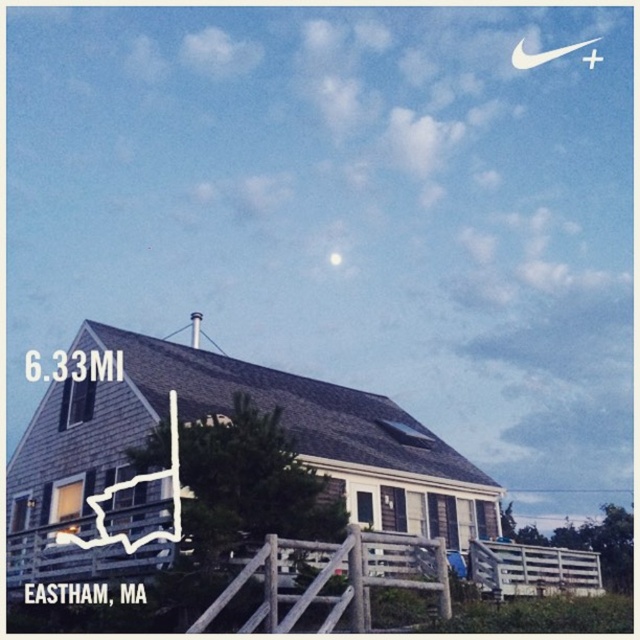
Question: Which of the following is the closest to the observer?

Choices:
 (A) (572, 49)
 (B) (340, 257)

Answer: (B)

Question: Does white fabric crescent at upper right have a larger size compared to bright silver moon at upper center?

Choices:
 (A) yes
 (B) no

Answer: (A)

Question: Which point is closer to the camera taking this photo?

Choices:
 (A) (531, 65)
 (B) (340, 260)

Answer: (B)

Question: Can you confirm if white fabric crescent at upper right is bigger than bright silver moon at upper center?

Choices:
 (A) no
 (B) yes

Answer: (B)

Question: Can you confirm if white fabric crescent at upper right is positioned above bright silver moon at upper center?

Choices:
 (A) no
 (B) yes

Answer: (B)